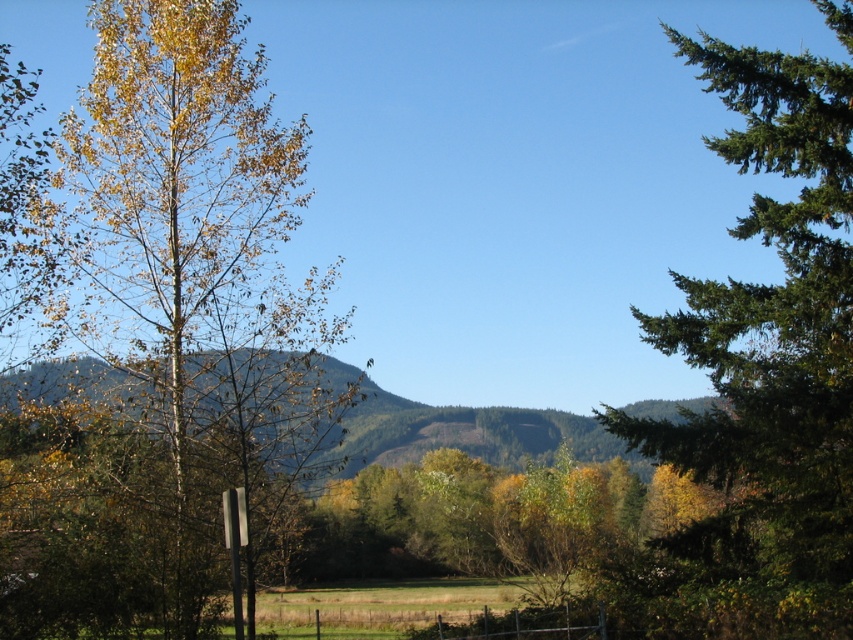
Question: Among these points, which one is farthest from the camera?

Choices:
 (A) (440, 408)
 (B) (676, 596)
 (C) (142, 44)

Answer: (A)

Question: Does yellow-green foliage at left have a larger size compared to green evergreen tree at right?

Choices:
 (A) no
 (B) yes

Answer: (B)

Question: Which of the following is the closest to the observer?

Choices:
 (A) green evergreen tree at right
 (B) green forested mountain at center
 (C) yellow-green foliage at left

Answer: (C)

Question: Which of the following is the farthest from the observer?

Choices:
 (A) (628, 456)
 (B) (746, 333)

Answer: (A)

Question: Is green evergreen tree at right further to camera compared to green forested mountain at center?

Choices:
 (A) yes
 (B) no

Answer: (A)

Question: Can you confirm if yellow-green foliage at left is positioned to the left of green evergreen tree at right?

Choices:
 (A) no
 (B) yes

Answer: (B)